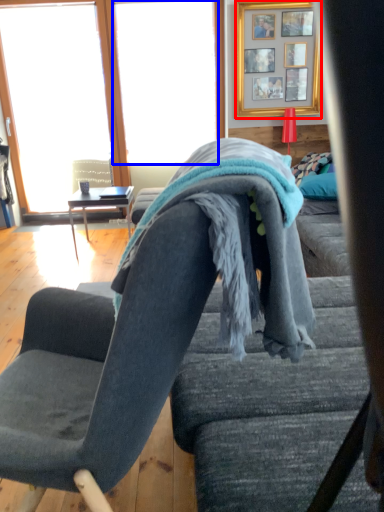
Question: Among these objects, which one is nearest to the camera, picture frame (highlighted by a red box) or window screen (highlighted by a blue box)?

Choices:
 (A) picture frame
 (B) window screen

Answer: (A)